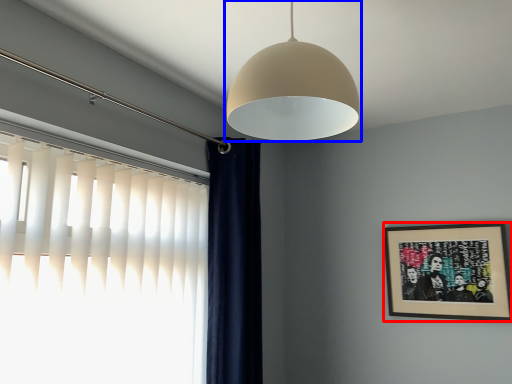
Question: Which object is further to the camera taking this photo, picture frame (highlighted by a red box) or lamp (highlighted by a blue box)?

Choices:
 (A) picture frame
 (B) lamp

Answer: (A)